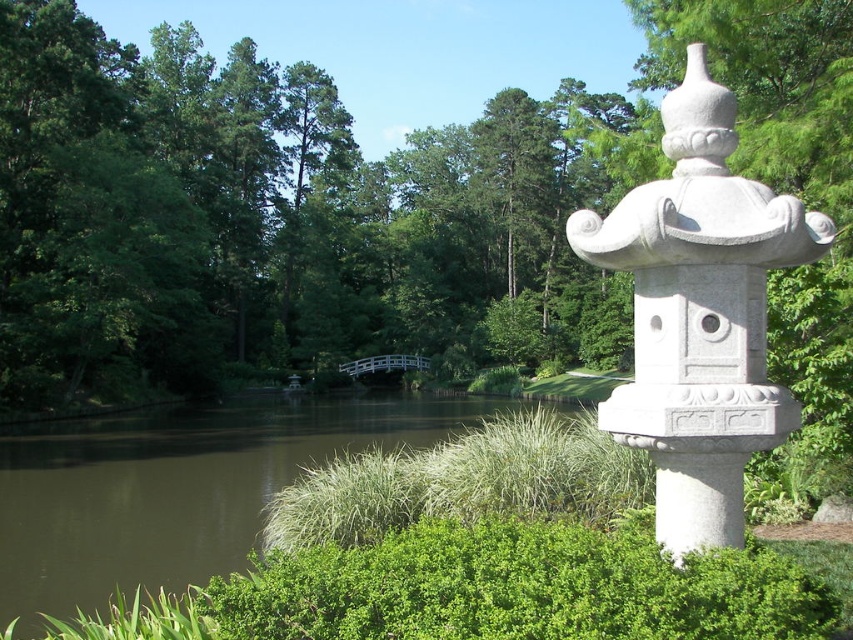
You are standing at the point labeled as point (682,541) in the garden. A friend is standing exactly where you are viewing this scene from. How far apart are you and your friend?

You and your friend are 13.99 feet apart from each other because the point (682,541) and viewer are 13.99 feet apart from each other.

You are designing a miniature garden and want to place the white stone lantern at upper right and the brown water at center. Based on their sizes, which object should you place first to ensure proper spacing?

The white stone lantern at upper right occupies less space than the brown water at center, so you should place the brown water at center first to ensure there is enough space for both objects.

You are a visitor in the garden and want to take a photo of the white stone lantern at upper right and the brown water at center. Which object will appear taller in the photo?

The white stone lantern at upper right will appear taller in the photo because it has a greater height compared to the brown water at center.